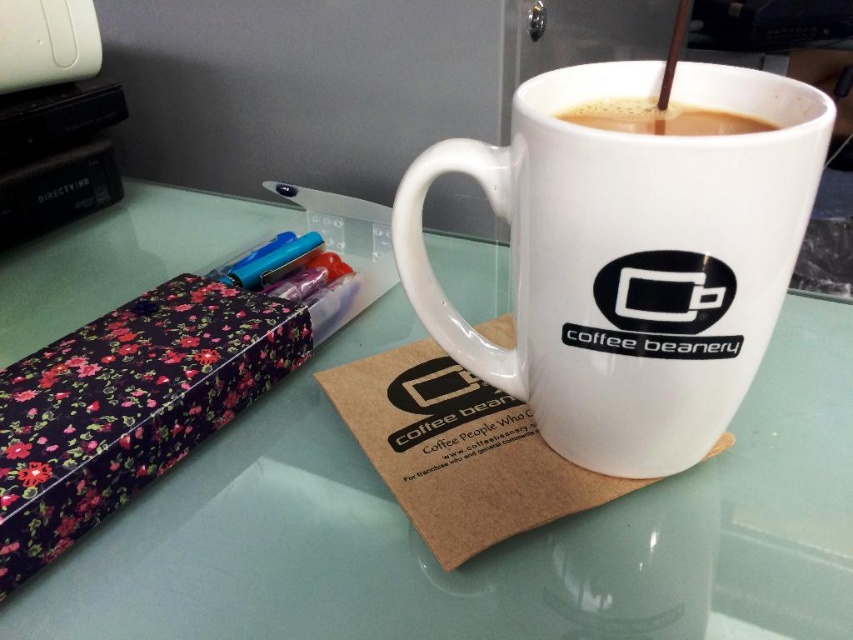
Is transparent glass table at center shorter than white ceramic mug at center?

Yes, transparent glass table at center is shorter than white ceramic mug at center.

Can you confirm if transparent glass table at center is positioned above white ceramic mug at center?

Actually, transparent glass table at center is below white ceramic mug at center.

Where is `transparent glass table at center`? This screenshot has height=640, width=853. transparent glass table at center is located at coordinates point(486,552).

Can you confirm if white ceramic mug at center is bigger than floral-patterned paper at left?

Yes, white ceramic mug at center is bigger than floral-patterned paper at left.

Can you confirm if white ceramic mug at center is wider than floral-patterned paper at left?

Yes.

The image size is (853, 640). What are the coordinates of `white ceramic mug at center` in the screenshot? It's located at (630, 257).

Is white ceramic mug at center behind matte plastic pen at upper left?

No, it is not.

Is white ceramic mug at center smaller than matte plastic pen at upper left?

No.

Where is `white ceramic mug at center`? This screenshot has height=640, width=853. white ceramic mug at center is located at coordinates (630, 257).